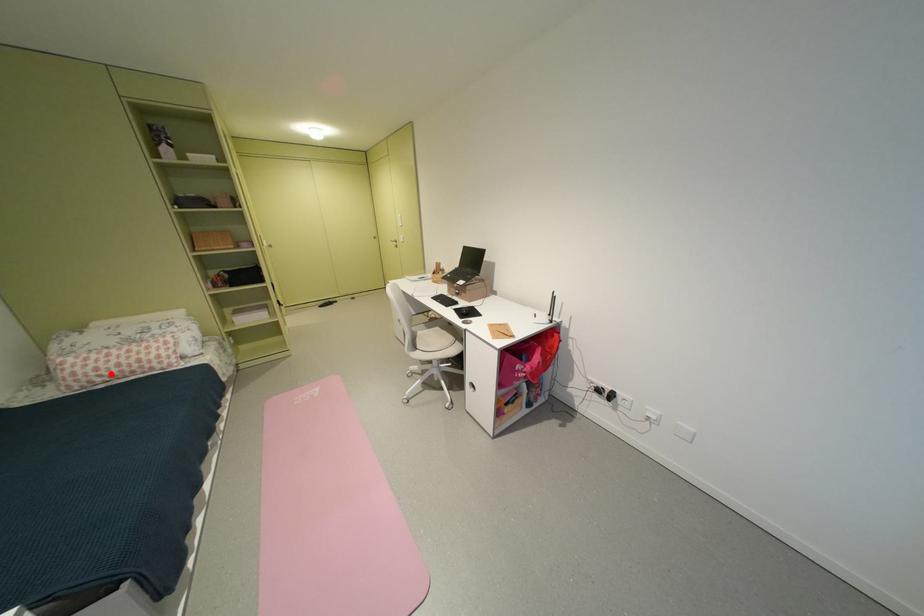
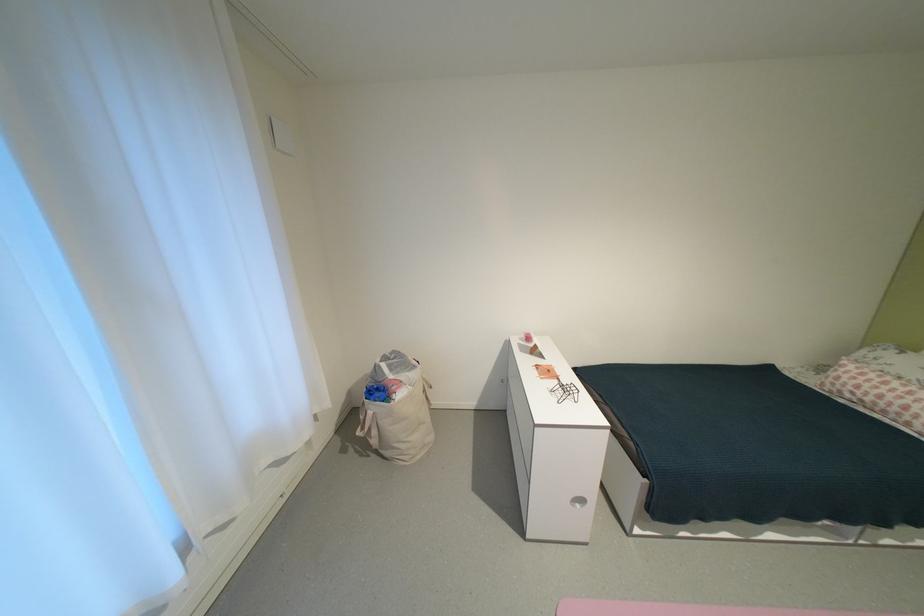
The point at the highlighted location is marked in the first image. Where is the corresponding point in the second image?

(867, 392)